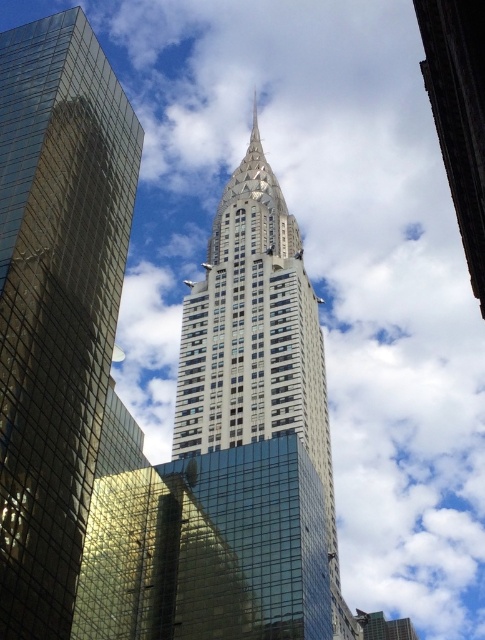
Is glassy steel skyscraper at center closer to the viewer compared to glassy steel tower at center?

Yes, glassy steel skyscraper at center is closer to the viewer.

Does glassy steel skyscraper at center have a greater width compared to glassy steel tower at center?

No.

At what (x,y) coordinates should I click in order to perform the action: click on glassy steel skyscraper at center. Please return your answer as a coordinate pair (x, y). The image size is (485, 640). Looking at the image, I should click on tap(55, 301).

Locate an element on the screen. This screenshot has width=485, height=640. glassy steel skyscraper at center is located at coordinates (55, 301).